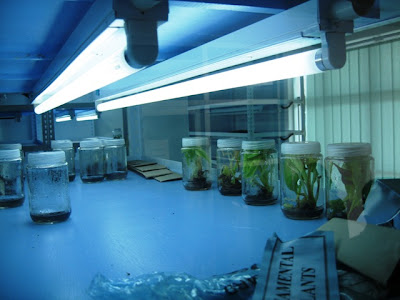
Locate an element on the screen. blinds is located at coordinates (335, 119), (312, 119), (318, 119), (327, 119), (343, 120), (351, 120), (362, 121), (374, 121), (386, 122), (395, 119).